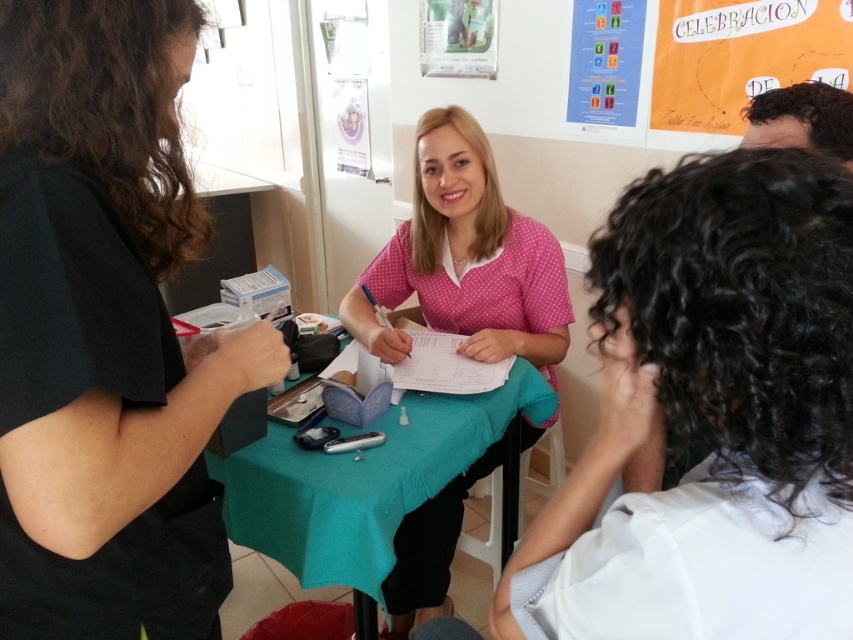
You are standing in the community center and want to reach the point at coordinates (190,451). If your arm length is 27 inches, can you reach it without moving?

The point at coordinates (190,451) is 27.66 inches away from you, which is slightly beyond your arm length of 27 inches. Therefore, you cannot reach it without moving closer.

You are a volunteer at the community center and need to hand out forms to both the person in the black matte shirt at left and the person in the pink dotted shirt at center. Which person should you approach first if you want to reach the shorter individual?

The black matte shirt at left is shorter than the pink dotted shirt at center, so you should approach the person in the black matte shirt at left first.

Where is the pink dotted shirt at center located in the image?

The pink dotted shirt at center is located at point (465, 259) in the image.